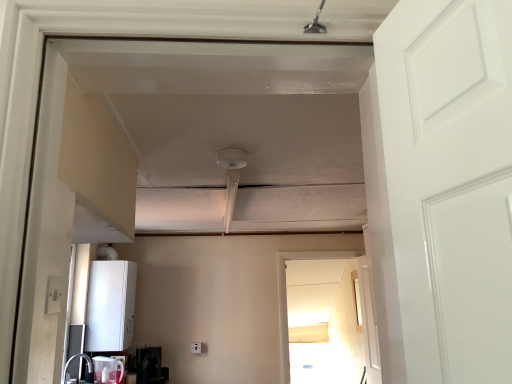
Question: From the image's perspective, is white matte boiler at lower left, the 3th appliance when ordered from bottom to top, on top of transparent glass screen door at center?

Choices:
 (A) no
 (B) yes

Answer: (B)

Question: From a real-world perspective, is white matte boiler at lower left, which ranks as the 1th appliance in top-to-bottom order, located beneath transparent glass screen door at center?

Choices:
 (A) yes
 (B) no

Answer: (B)

Question: Can you confirm if white matte boiler at lower left, the 3th appliance when ordered from bottom to top, is bigger than transparent glass screen door at center?

Choices:
 (A) no
 (B) yes

Answer: (B)

Question: Could you tell me if white matte boiler at lower left, the 3th appliance when ordered from bottom to top, is turned towards transparent glass screen door at center?

Choices:
 (A) yes
 (B) no

Answer: (A)

Question: Does white matte boiler at lower left, the 3th appliance when ordered from bottom to top, have a lesser height compared to transparent glass screen door at center?

Choices:
 (A) no
 (B) yes

Answer: (B)

Question: Would you consider white matte boiler at lower left, which ranks as the 1th appliance in top-to-bottom order, to be distant from transparent glass screen door at center?

Choices:
 (A) yes
 (B) no

Answer: (A)

Question: Is matte white sink at lower left turned away from white plastic electric outlet at lower left?

Choices:
 (A) yes
 (B) no

Answer: (B)

Question: Is matte white sink at lower left completely or partially outside of white plastic electric outlet at lower left?

Choices:
 (A) yes
 (B) no

Answer: (A)

Question: From a real-world perspective, does matte white sink at lower left stand above white plastic electric outlet at lower left?

Choices:
 (A) yes
 (B) no

Answer: (B)

Question: Does matte white sink at lower left have a smaller size compared to white plastic electric outlet at lower left?

Choices:
 (A) yes
 (B) no

Answer: (B)

Question: Is the position of matte white sink at lower left more distant than that of white plastic electric outlet at lower left?

Choices:
 (A) no
 (B) yes

Answer: (B)

Question: Is white plastic electric outlet at lower left surrounded by matte white sink at lower left?

Choices:
 (A) no
 (B) yes

Answer: (A)

Question: Is white glossy door at right taller than transparent glass screen door at center?

Choices:
 (A) yes
 (B) no

Answer: (B)